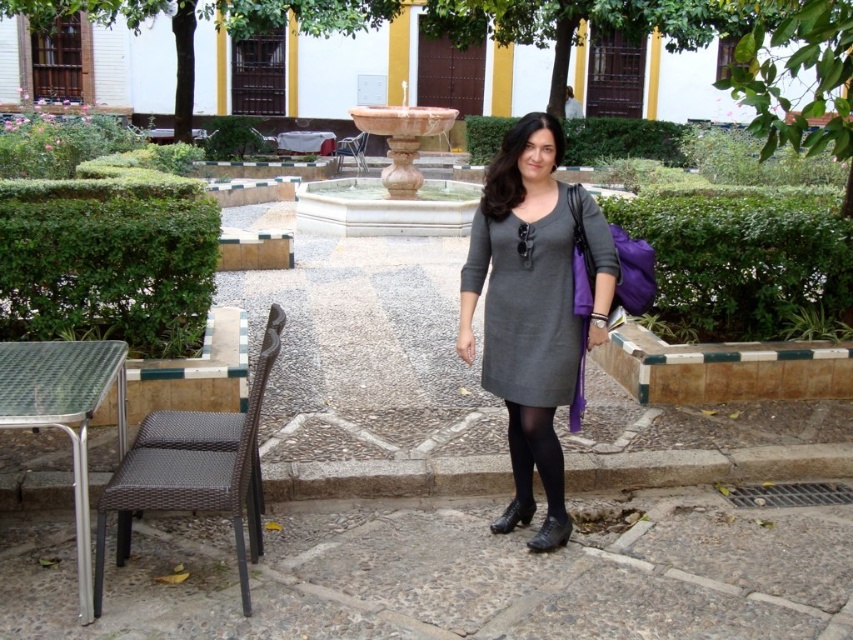
Question: Is gray matte dress at center to the left of black tights at lower center from the viewer's perspective?

Choices:
 (A) no
 (B) yes

Answer: (B)

Question: Which object is closer to the camera taking this photo?

Choices:
 (A) gray matte dress at center
 (B) black tights at lower center
 (C) gray wool dress at center

Answer: (C)

Question: Is gray wool dress at center below brown wicker chair at center?

Choices:
 (A) yes
 (B) no

Answer: (A)

Question: Among these objects, which one is nearest to the camera?

Choices:
 (A) silver metallic table at lower left
 (B) gray matte dress at center

Answer: (A)

Question: Among these objects, which one is farthest from the camera?

Choices:
 (A) gray wool dress at center
 (B) brown wicker chair at lower left

Answer: (A)

Question: Can you confirm if gray matte dress at center is smaller than black tights at lower center?

Choices:
 (A) yes
 (B) no

Answer: (B)